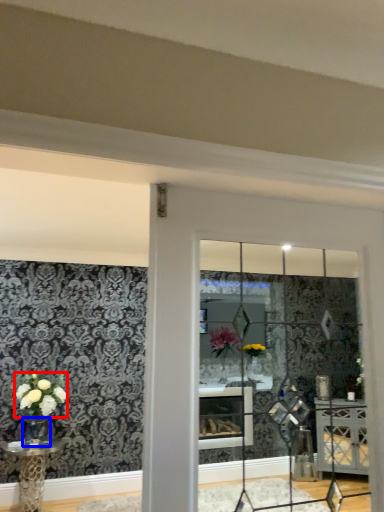
Question: Which of the following is the closest to the observer, flower (highlighted by a red box) or glass vase (highlighted by a blue box)?

Choices:
 (A) flower
 (B) glass vase

Answer: (A)